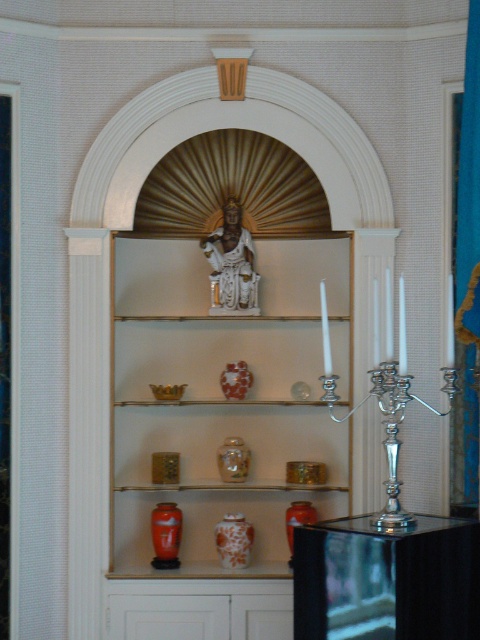
You are an interior designer arranging items in the alcove. You need to place a new decorative item between the white glossy statue at upper center and the silver metallic candelabra at right. Based on their current positions, where should you place the new item?

The new item should be placed between the white glossy statue at upper center and the silver metallic candelabra at right, as the statue is on the left side of the candelabra.